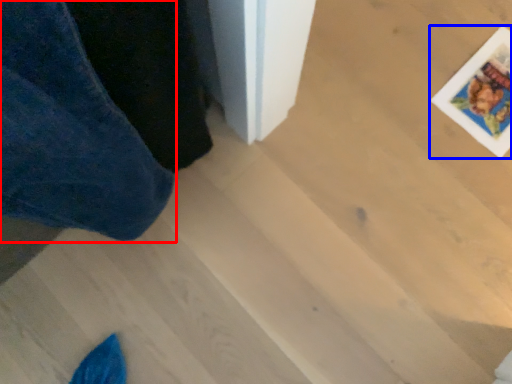
Question: Which point is further to the camera, trousers (highlighted by a red box) or postcard (highlighted by a blue box)?

Choices:
 (A) trousers
 (B) postcard

Answer: (B)